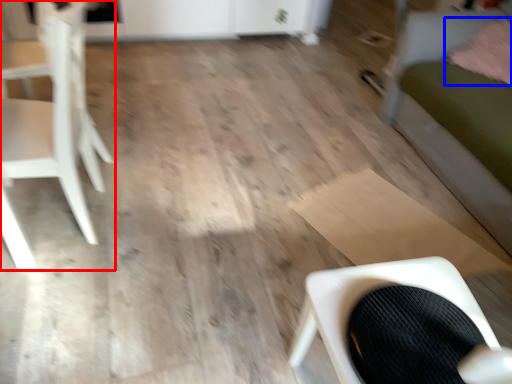
Question: Which object is further to the camera taking this photo, chair (highlighted by a red box) or pillow (highlighted by a blue box)?

Choices:
 (A) chair
 (B) pillow

Answer: (B)